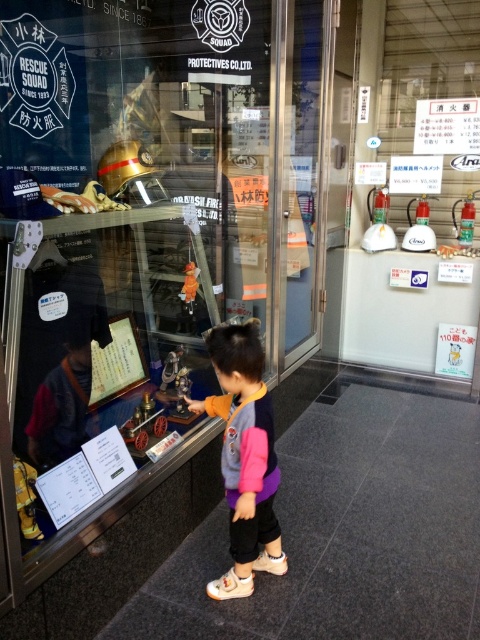
Who is more forward, (237, 524) or (110, 394)?

Point (237, 524) is more forward.

Identify the location of multicolored fabric jacket at center. This screenshot has height=640, width=480. (244, 458).

Where is `multicolored fabric jacket at center`? The width and height of the screenshot is (480, 640). multicolored fabric jacket at center is located at coordinates (244, 458).

Identify the location of multicolored fabric jacket at center. This screenshot has width=480, height=640. (244, 458).